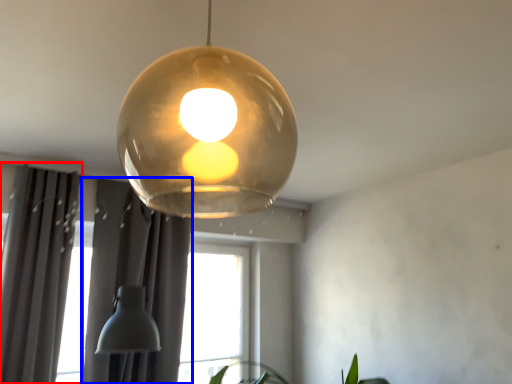
Question: Among these objects, which one is nearest to the camera, curtain (highlighted by a red box) or curtain (highlighted by a blue box)?

Choices:
 (A) curtain
 (B) curtain

Answer: (A)